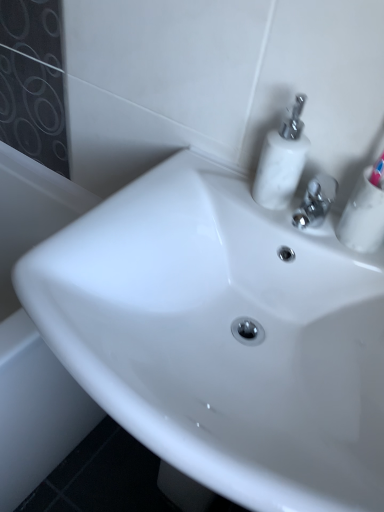
What do you see at coordinates (282, 159) in the screenshot? I see `white glossy soap dispenser at upper right` at bounding box center [282, 159].

Find the location of a particular element. The height and width of the screenshot is (512, 384). white glossy mouthwash at upper right is located at coordinates (364, 215).

At what (x,y) coordinates should I click in order to perform the action: click on white glossy sink at center. Please return your answer as a coordinate pair (x, y). Looking at the image, I should click on (222, 337).

From the image's perspective, which one is positioned lower, white glossy bath at lower left or white glossy sink at center?

From the image's view, white glossy sink at center is below.

Identify the location of bath that is under the white glossy sink at center (from a real-world perspective). The image size is (384, 512). (34, 335).

Would you say white glossy bath at lower left is inside or outside white glossy sink at center?

white glossy bath at lower left is not inside white glossy sink at center, it's outside.

Is the position of white glossy bath at lower left more distant than that of white glossy sink at center?

Yes.

Is white glossy soap dispenser at upper right smaller than white glossy sink at center?

Yes.

From a real-world perspective, does white glossy soap dispenser at upper right stand above white glossy sink at center?

Indeed, from a real-world perspective, white glossy soap dispenser at upper right stands above white glossy sink at center.

Considering the positions of objects white glossy soap dispenser at upper right and white glossy sink at center in the image provided, who is more to the left, white glossy soap dispenser at upper right or white glossy sink at center?

white glossy sink at center is more to the left.

Considering the relative positions of white glossy soap dispenser at upper right and white glossy sink at center in the image provided, is white glossy soap dispenser at upper right behind white glossy sink at center?

Yes, white glossy soap dispenser at upper right is further from the viewer.

Which of these two, white glossy sink at center or white glossy mouthwash at upper right, is smaller?

Smaller between the two is white glossy mouthwash at upper right.

Between white glossy sink at center and white glossy mouthwash at upper right, which one appears on the left side from the viewer's perspective?

white glossy sink at center.

Considering the points (133, 298) and (380, 218), which point is behind, point (133, 298) or point (380, 218)?

Positioned behind is point (133, 298).

From the picture: Between white glossy sink at center and white glossy mouthwash at upper right, which one has less height?

With less height is white glossy mouthwash at upper right.

Which is farther from the camera, (336,231) or (5,193)?

The point (5,193) is behind.

Is white glossy mouthwash at upper right positioned behind white glossy bath at lower left?

No, it is not.

From the image's perspective, which is above, white glossy mouthwash at upper right or white glossy bath at lower left?

white glossy mouthwash at upper right, from the image's perspective.

Identify the location of bath that is on the left side of white glossy mouthwash at upper right. The height and width of the screenshot is (512, 384). (34, 335).

Which is in front, point (49, 451) or point (372, 203)?

The point (372, 203) is in front.

Which object is further away from the camera taking this photo, white glossy bath at lower left or white glossy mouthwash at upper right?

Positioned behind is white glossy bath at lower left.

Can you see white glossy bath at lower left touching white glossy mouthwash at upper right?

No, white glossy bath at lower left is not touching white glossy mouthwash at upper right.

From the image's perspective, which is below, white glossy sink at center or white glossy bath at lower left?

white glossy sink at center.

Considering the relative sizes of white glossy sink at center and white glossy bath at lower left in the image provided, is white glossy sink at center wider than white glossy bath at lower left?

No.

Is white glossy sink at center inside or outside of white glossy bath at lower left?

white glossy sink at center is not enclosed by white glossy bath at lower left.

Are white glossy sink at center and white glossy bath at lower left beside each other?

No, white glossy sink at center is not beside white glossy bath at lower left.

From a real-world perspective, is white glossy soap dispenser at upper right above or below white glossy mouthwash at upper right?

Clearly, from a real-world perspective, white glossy soap dispenser at upper right is above white glossy mouthwash at upper right.

Is white glossy soap dispenser at upper right outside of white glossy mouthwash at upper right?

That's correct, white glossy soap dispenser at upper right is outside of white glossy mouthwash at upper right.

Is white glossy soap dispenser at upper right positioned with its back to white glossy mouthwash at upper right?

white glossy soap dispenser at upper right is not turned away from white glossy mouthwash at upper right.

Relative to white glossy mouthwash at upper right, is white glossy soap dispenser at upper right in front or behind?

In the image, white glossy soap dispenser at upper right appears behind white glossy mouthwash at upper right.

Where is `sink in front of the white glossy bath at lower left`? sink in front of the white glossy bath at lower left is located at coordinates (222, 337).

Locate an element on the screen. This screenshot has width=384, height=512. soap dispenser above the white glossy sink at center (from the image's perspective) is located at coordinates (282, 159).

In the scene shown: From the image, which object appears to be nearer to white glossy bath at lower left, white glossy sink at center or white glossy soap dispenser at upper right?

white glossy sink at center.

Looking at the image, which one is located further to white glossy sink at center, white glossy mouthwash at upper right or white glossy soap dispenser at upper right?

white glossy mouthwash at upper right is further to white glossy sink at center.

When comparing their distances from white glossy mouthwash at upper right, does white glossy sink at center or white glossy soap dispenser at upper right seem further?

white glossy sink at center lies further to white glossy mouthwash at upper right than the other object.

Considering their positions, is white glossy mouthwash at upper right positioned further to white glossy soap dispenser at upper right than white glossy bath at lower left?

white glossy bath at lower left is further to white glossy soap dispenser at upper right.

From the image, which object appears to be nearer to white glossy bath at lower left, white glossy mouthwash at upper right or white glossy sink at center?

white glossy sink at center is positioned closer to the anchor white glossy bath at lower left.

Considering their positions, is white glossy soap dispenser at upper right positioned further to white glossy sink at center than white glossy bath at lower left?

white glossy bath at lower left.

Which object lies nearer to the anchor point white glossy bath at lower left, white glossy soap dispenser at upper right or white glossy mouthwash at upper right?

Among the two, white glossy soap dispenser at upper right is located nearer to white glossy bath at lower left.

Looking at the image, which one is located further to white glossy soap dispenser at upper right, white glossy bath at lower left or white glossy sink at center?

white glossy bath at lower left is further to white glossy soap dispenser at upper right.

Where is `sink located between white glossy bath at lower left and white glossy mouthwash at upper right in the left-right direction`? This screenshot has height=512, width=384. sink located between white glossy bath at lower left and white glossy mouthwash at upper right in the left-right direction is located at coordinates (222, 337).

Find the location of a particular element. This screenshot has height=512, width=384. mouthwash that lies between white glossy soap dispenser at upper right and white glossy sink at center from top to bottom is located at coordinates (364, 215).

Locate an element on the screen. The image size is (384, 512). sink between white glossy bath at lower left and white glossy soap dispenser at upper right in the horizontal direction is located at coordinates [x=222, y=337].

You are a GUI agent. You are given a task and a screenshot of the screen. Output one action in this format:
    pyautogui.click(x=<x>, y=<y>)
    Task: Click on the soap dispenser between white glossy bath at lower left and white glossy mouthwash at upper right
    The width and height of the screenshot is (384, 512).
    Given the screenshot: What is the action you would take?
    pyautogui.click(x=282, y=159)